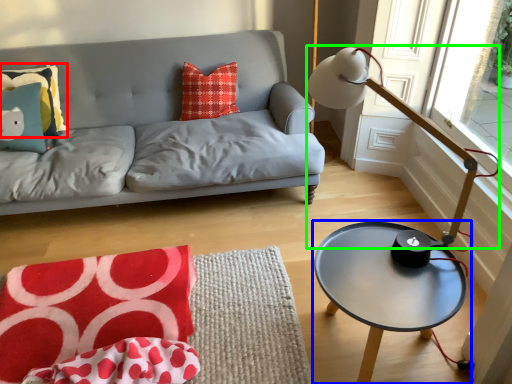
Question: Which is nearer to the pillow (highlighted by a red box)? coffee table (highlighted by a blue box) or table lamp (highlighted by a green box).

Choices:
 (A) coffee table
 (B) table lamp

Answer: (B)